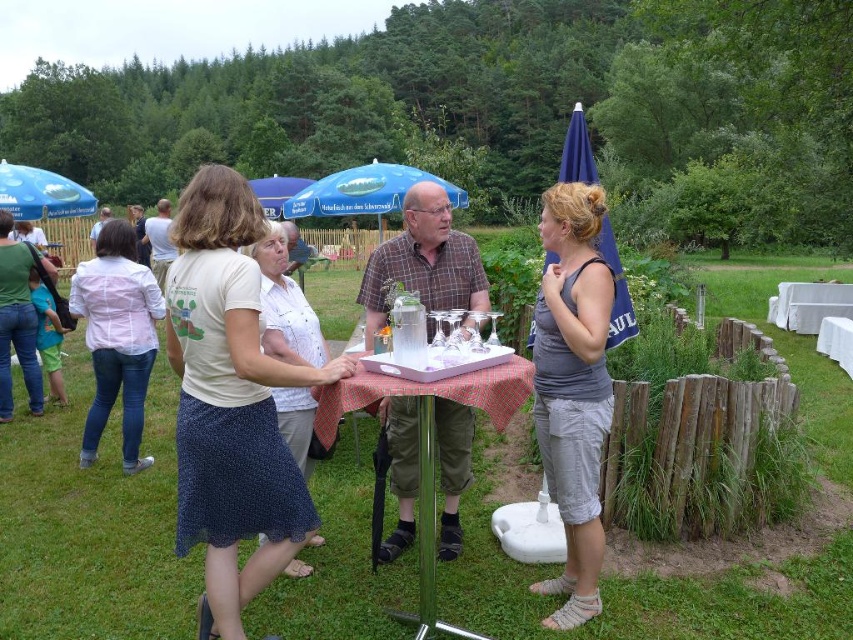
Can you confirm if white matte shirt at left is positioned to the right of white cotton blouse at center?

In fact, white matte shirt at left is to the left of white cotton blouse at center.

Who is positioned more to the right, white matte shirt at left or white cotton blouse at center?

From the viewer's perspective, white cotton blouse at center appears more on the right side.

Where is `white matte shirt at left`? This screenshot has height=640, width=853. white matte shirt at left is located at coordinates (117, 337).

The image size is (853, 640). Identify the location of white matte shirt at left. (117, 337).

Can you confirm if white matte shirt at left is positioned to the left of blue fabric umbrella at upper left?

No, white matte shirt at left is not to the left of blue fabric umbrella at upper left.

Does white matte shirt at left appear under blue fabric umbrella at upper left?

Yes, white matte shirt at left is below blue fabric umbrella at upper left.

Who is more distant from viewer, (103, 323) or (32, 220)?

The point (32, 220) is more distant.

Where is `white matte shirt at left`? Image resolution: width=853 pixels, height=640 pixels. white matte shirt at left is located at coordinates (117, 337).

What do you see at coordinates (230, 403) in the screenshot? I see `white cotton shirt at center` at bounding box center [230, 403].

Can you confirm if white cotton shirt at center is positioned to the left of blue fabric umbrella at upper left?

Incorrect, white cotton shirt at center is not on the left side of blue fabric umbrella at upper left.

Image resolution: width=853 pixels, height=640 pixels. What do you see at coordinates (230, 403) in the screenshot?
I see `white cotton shirt at center` at bounding box center [230, 403].

I want to click on white cotton shirt at center, so click(x=230, y=403).